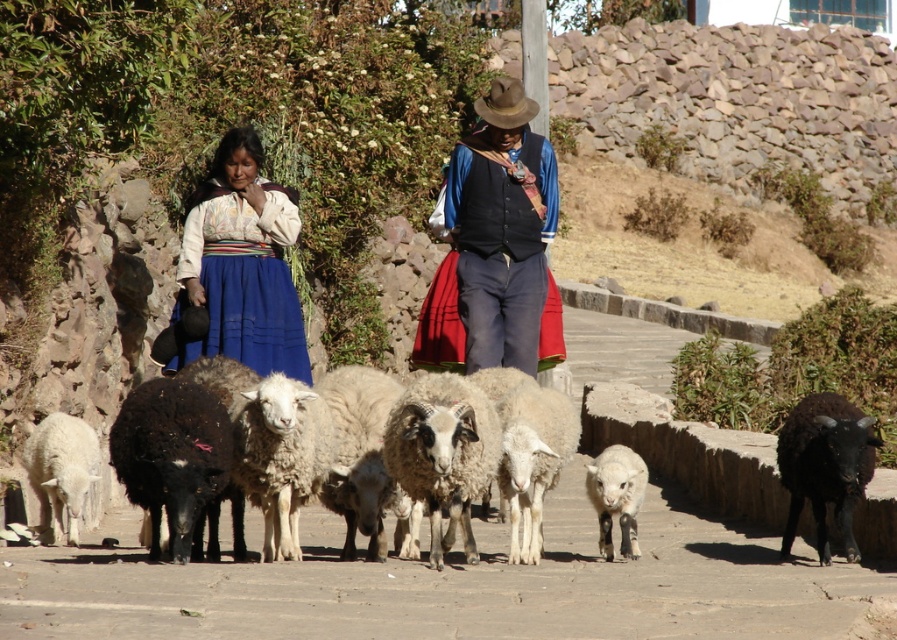
Question: Which of the following is the farthest from the observer?

Choices:
 (A) brown felt cowboy hat at center
 (B) fuzzy woolen sheep at center

Answer: (A)

Question: From the image, what is the correct spatial relationship of velvet black vest at center in relation to black woolen goat at lower right?

Choices:
 (A) left
 (B) right

Answer: (A)

Question: Can you confirm if velvet black vest at center is thinner than brown felt cowboy hat at center?

Choices:
 (A) no
 (B) yes

Answer: (B)

Question: Which point appears closest to the camera in this image?

Choices:
 (A) (532, 204)
 (B) (527, 104)

Answer: (A)

Question: Estimate the real-world distances between objects in this image. Which object is farther from the matte blue skirt at center?

Choices:
 (A) white woolly lamb at center
 (B) brown felt cowboy hat at center
 (C) fuzzy woolen sheep at center

Answer: (C)

Question: Is black woolen goat at lower right bigger than white woolly sheep at lower left?

Choices:
 (A) yes
 (B) no

Answer: (B)